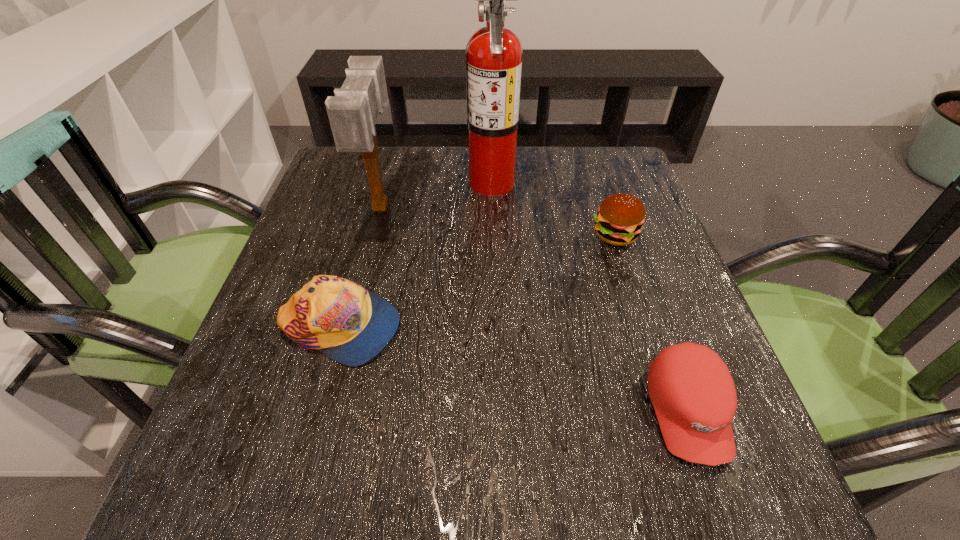
Identify the location of vacant space that satisfies the following two spatial constraints: 1. on the nozzle side of the tallest object; 2. on the front side of the fourth shortest object. This screenshot has height=540, width=960. (492, 207).

Locate an element on the screen. The height and width of the screenshot is (540, 960). vacant space that satisfies the following two spatial constraints: 1. on the front side of the second tallest object; 2. on the left side of the hamburger is located at coordinates (374, 235).